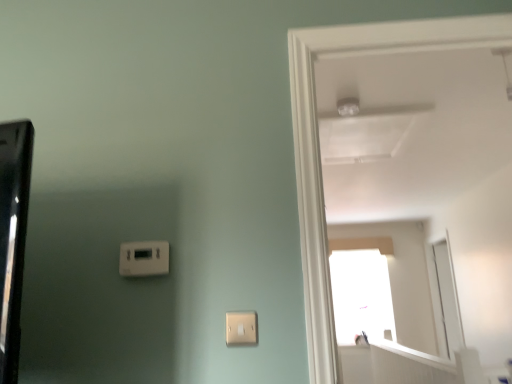
Locate an element on the screen. white plastic light switch at lower center, the first light switch positioned from the bottom is located at coordinates (x=241, y=328).

What is the approximate width of white plastic thermostat at lower left, which ranks as the second light switch in right-to-left order?

It is 1.45 inches.

Locate an element on the screen. This screenshot has height=384, width=512. white glossy door at upper right is located at coordinates (319, 144).

Is point (255, 324) closer or farther from the camera than point (164, 260)?

Clearly, point (255, 324) is closer to the camera than point (164, 260).

Is white plastic light switch at lower center, positioned as the second light switch in top-to-bottom order, facing away from white plastic thermostat at lower left, which is the first light switch in left-to-right order?

white plastic light switch at lower center, positioned as the second light switch in top-to-bottom order, is not turned away from white plastic thermostat at lower left, which is the first light switch in left-to-right order.

Is the position of white plastic thermostat at lower left, which ranks as the second light switch in right-to-left order, more distant than that of white glossy door at upper right?

That is True.

From a real-world perspective, which is physically above, white plastic thermostat at lower left, which is the 2th light switch in bottom-to-top order, or white glossy door at upper right?

white glossy door at upper right, from a real-world perspective.

Based on the photo, measure the distance from white plastic thermostat at lower left, placed as the first light switch when sorted from top to bottom, to white glossy door at upper right.

24.30 inches.

There is a white glossy door at upper right. Where is `the 1st light switch below it (from the image's perspective)`? the 1st light switch below it (from the image's perspective) is located at coordinates (144, 258).

From the image's perspective, is white plastic thermostat at lower left, which is the first light switch in left-to-right order, above or below white plastic light switch at lower center, the first light switch viewed from the right?

Based on their image positions, white plastic thermostat at lower left, which is the first light switch in left-to-right order, is located above white plastic light switch at lower center, the first light switch viewed from the right.

From the picture: Who is shorter, white plastic thermostat at lower left, placed as the second light switch when sorted from front to back, or white plastic light switch at lower center, the second light switch when ordered from left to right?

With less height is white plastic light switch at lower center, the second light switch when ordered from left to right.

Would you say white plastic thermostat at lower left, placed as the first light switch when sorted from top to bottom, is a long distance from white plastic light switch at lower center, the second light switch when ordered from left to right?

They are positioned close to each other.

The image size is (512, 384). Find the location of `light switch that appears on the left of white plastic light switch at lower center, positioned as the second light switch in top-to-bottom order`. light switch that appears on the left of white plastic light switch at lower center, positioned as the second light switch in top-to-bottom order is located at coordinates (144, 258).

From the image's perspective, which object appears higher, white glossy door at upper right or white plastic thermostat at lower left, placed as the second light switch when sorted from front to back?

white glossy door at upper right, from the image's perspective.

Could you measure the distance between white glossy door at upper right and white plastic thermostat at lower left, which ranks as the second light switch in right-to-left order?

24.30 inches.

Who is smaller, white glossy door at upper right or white plastic thermostat at lower left, placed as the first light switch when sorted from top to bottom?

white plastic thermostat at lower left, placed as the first light switch when sorted from top to bottom.

How many degrees apart are the facing directions of white glossy door at upper right and white plastic thermostat at lower left, placed as the second light switch when sorted from front to back?

There is a 178-degree angle between the facing directions of white glossy door at upper right and white plastic thermostat at lower left, placed as the second light switch when sorted from front to back.

Are white plastic light switch at lower center, the second light switch when ordered from left to right, and white glossy door at upper right making contact?

No, white plastic light switch at lower center, the second light switch when ordered from left to right, is not in contact with white glossy door at upper right.

Considering the relative sizes of white plastic light switch at lower center, the 2th light switch positioned from the back, and white glossy door at upper right in the image provided, is white plastic light switch at lower center, the 2th light switch positioned from the back, thinner than white glossy door at upper right?

Indeed, white plastic light switch at lower center, the 2th light switch positioned from the back, has a lesser width compared to white glossy door at upper right.

Between white plastic light switch at lower center, the 2th light switch positioned from the back, and white glossy door at upper right, which one appears on the left side from the viewer's perspective?

white plastic light switch at lower center, the 2th light switch positioned from the back.

Does white plastic light switch at lower center, the first light switch positioned from the bottom, have a larger size compared to white glossy door at upper right?

No.

Considering the relative positions of white glossy door at upper right and white plastic light switch at lower center, positioned as the second light switch in top-to-bottom order, in the image provided, is white glossy door at upper right to the right of white plastic light switch at lower center, positioned as the second light switch in top-to-bottom order, from the viewer's perspective?

Yes, white glossy door at upper right is to the right of white plastic light switch at lower center, positioned as the second light switch in top-to-bottom order.

From the image's perspective, is white glossy door at upper right positioned above or below white plastic light switch at lower center, positioned as the second light switch in top-to-bottom order?

From the image's perspective, white glossy door at upper right appears above white plastic light switch at lower center, positioned as the second light switch in top-to-bottom order.

Is white glossy door at upper right directly adjacent to white plastic light switch at lower center, the 2th light switch positioned from the back?

white glossy door at upper right is not next to white plastic light switch at lower center, the 2th light switch positioned from the back, and they're not touching.

Identify the location of light switch that appears in front of the white plastic thermostat at lower left, which ranks as the second light switch in right-to-left order. The width and height of the screenshot is (512, 384). (241, 328).

Locate an element on the screen. door that is above the white plastic thermostat at lower left, marked as the first light switch in a back-to-front arrangement (from the image's perspective) is located at coordinates (319, 144).

From the image, which object appears to be farther from white glossy door at upper right, white plastic light switch at lower center, which is the 1th light switch from front to back, or white plastic thermostat at lower left, marked as the first light switch in a back-to-front arrangement?

white plastic thermostat at lower left, marked as the first light switch in a back-to-front arrangement, is positioned further to the anchor white glossy door at upper right.

From the image, which object appears to be nearer to white plastic light switch at lower center, which is the 1th light switch from front to back, white plastic thermostat at lower left, which ranks as the second light switch in right-to-left order, or white glossy door at upper right?

white plastic thermostat at lower left, which ranks as the second light switch in right-to-left order.

Estimate the real-world distances between objects in this image. Which object is further from white plastic thermostat at lower left, placed as the first light switch when sorted from top to bottom, white glossy door at upper right or white plastic light switch at lower center, which is the 1th light switch from front to back?

white glossy door at upper right lies further to white plastic thermostat at lower left, placed as the first light switch when sorted from top to bottom, than the other object.

Based on their spatial positions, is white plastic light switch at lower center, positioned as the second light switch in top-to-bottom order, or white glossy door at upper right closer to white plastic thermostat at lower left, which is the first light switch in left-to-right order?

white plastic light switch at lower center, positioned as the second light switch in top-to-bottom order, is positioned closer to the anchor white plastic thermostat at lower left, which is the first light switch in left-to-right order.

Looking at the image, which one is located closer to white glossy door at upper right, white plastic thermostat at lower left, placed as the second light switch when sorted from front to back, or white plastic light switch at lower center, the second light switch when ordered from left to right?

white plastic light switch at lower center, the second light switch when ordered from left to right, is positioned closer to the anchor white glossy door at upper right.

Based on their spatial positions, is white glossy door at upper right or white plastic thermostat at lower left, placed as the first light switch when sorted from top to bottom, closer to white plastic light switch at lower center, the first light switch viewed from the right?

Based on the image, white plastic thermostat at lower left, placed as the first light switch when sorted from top to bottom, appears to be nearer to white plastic light switch at lower center, the first light switch viewed from the right.

Image resolution: width=512 pixels, height=384 pixels. Identify the location of light switch between white plastic thermostat at lower left, which is the 2th light switch in bottom-to-top order, and white glossy door at upper right. (241, 328).